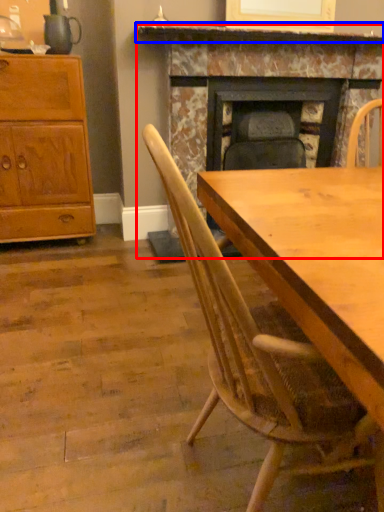
Question: Among these objects, which one is farthest to the camera, fireplace (highlighted by a red box) or mantle (highlighted by a blue box)?

Choices:
 (A) fireplace
 (B) mantle

Answer: (A)